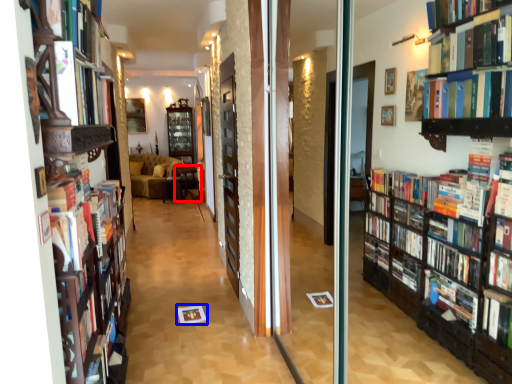
Question: Among these objects, which one is farthest to the camera, furniture (highlighted by a red box) or paperback book (highlighted by a blue box)?

Choices:
 (A) furniture
 (B) paperback book

Answer: (A)